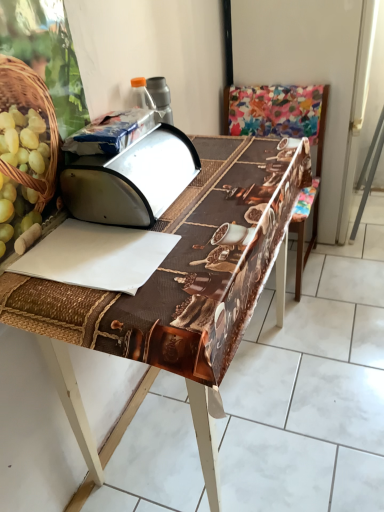
The width and height of the screenshot is (384, 512). Find the location of `free area below brown woven table at center (from a real-world perspective)`. free area below brown woven table at center (from a real-world perspective) is located at coordinates 183,420.